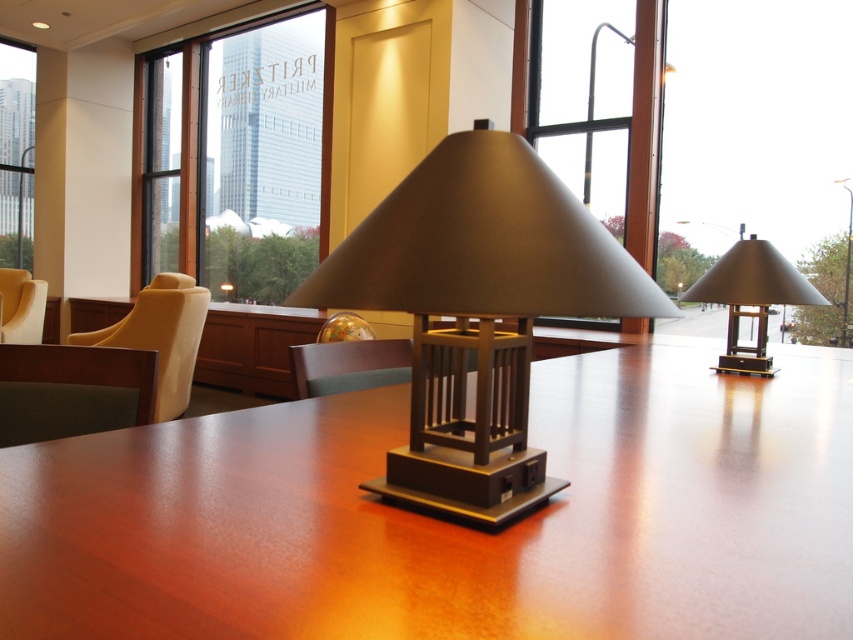
Question: Among these points, which one is farthest from the camera?

Choices:
 (A) (842, 305)
 (B) (165, 355)
 (C) (12, 275)

Answer: (C)

Question: Does brown wood table at center have a greater width compared to transparent glass window at left?

Choices:
 (A) no
 (B) yes

Answer: (B)

Question: Which point is closer to the camera?

Choices:
 (A) (376, 356)
 (B) (9, 280)

Answer: (A)

Question: Can you confirm if brown wood table at center is smaller than green fabric chair at lower left?

Choices:
 (A) yes
 (B) no

Answer: (B)

Question: Estimate the real-world distances between objects in this image. Which object is closer to the transparent glass window at upper left?

Choices:
 (A) transparent glass window at left
 (B) green fabric chair at lower left

Answer: (A)

Question: Is matte brown lamp at center bigger than transparent glass window at left?

Choices:
 (A) yes
 (B) no

Answer: (B)